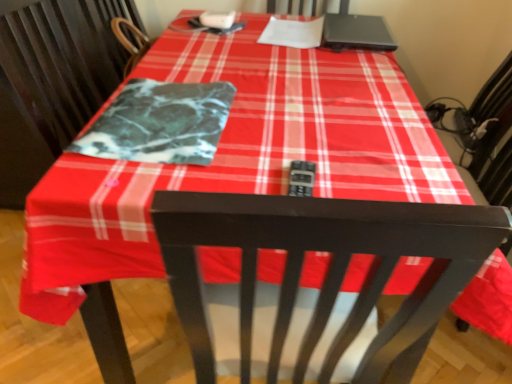
Identify the location of vacant area on top of black matte laptop at upper right (from a real-world perspective). (357, 22).